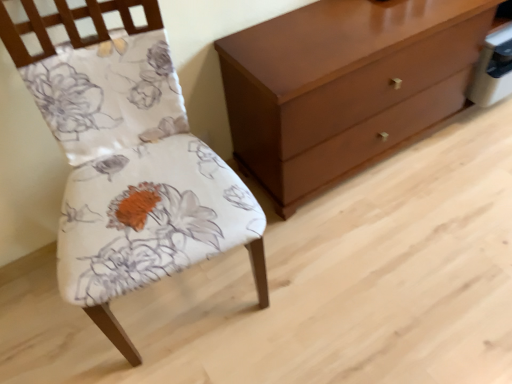
I want to click on vacant space in front of matte brown chest of drawers at right, so click(404, 243).